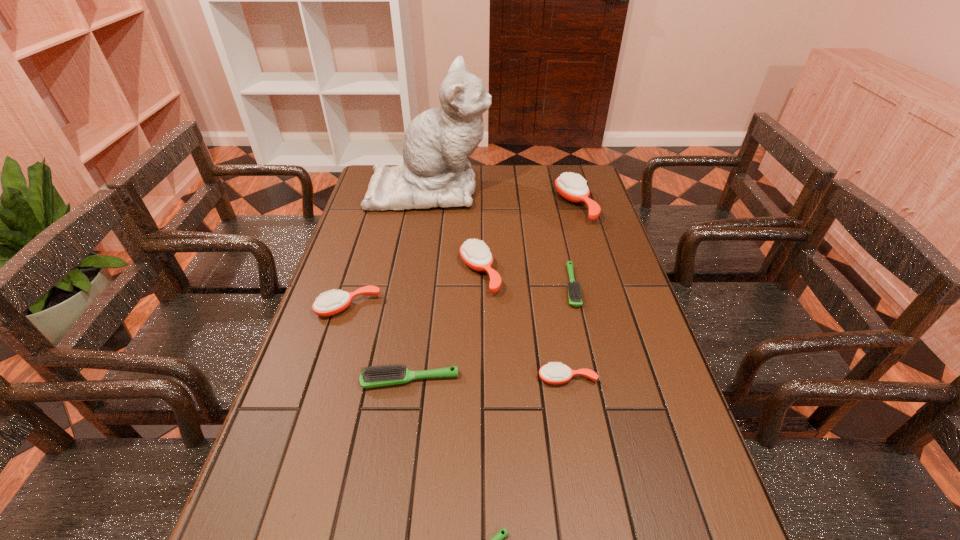
Where is `cat`? cat is located at coordinates (435, 172).

At what (x,y) coordinates should I click in order to perform the action: click on the rightmost orange hairbrush. Please return your answer as a coordinate pair (x, y). Looking at the image, I should click on (571, 186).

Locate an element on the screen. The height and width of the screenshot is (540, 960). the farthest hairbrush is located at coordinates (571, 186).

Where is `the second orange hairbrush from left to right`? The image size is (960, 540). the second orange hairbrush from left to right is located at coordinates (475, 254).

The image size is (960, 540). In order to click on the second biggest orange hairbrush in this screenshot , I will do `click(475, 254)`.

Image resolution: width=960 pixels, height=540 pixels. What are the coordinates of `the fifth shortest object` in the screenshot? It's located at (329, 304).

Where is `the third tallest hairbrush`? The height and width of the screenshot is (540, 960). the third tallest hairbrush is located at coordinates (329, 304).

Locate an element on the screen. This screenshot has height=540, width=960. the biggest light hairbrush is located at coordinates (383, 375).

Where is `the smallest orange hairbrush`? the smallest orange hairbrush is located at coordinates (552, 373).

I want to click on the second orange hairbrush from right to left, so click(x=552, y=373).